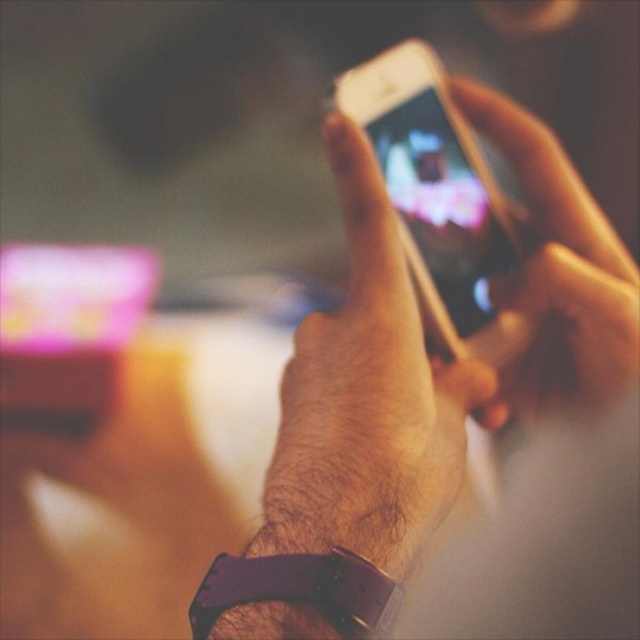
Does point (573, 371) come farther from viewer compared to point (390, 228)?

Yes, point (573, 371) is behind point (390, 228).

Who is lower down, metallic gold phone at center or matte skin hand at center?

Positioned lower is matte skin hand at center.

At what (x,y) coordinates should I click in order to perform the action: click on metallic gold phone at center. Please return your answer as a coordinate pair (x, y). The height and width of the screenshot is (640, 640). Looking at the image, I should click on (435, 360).